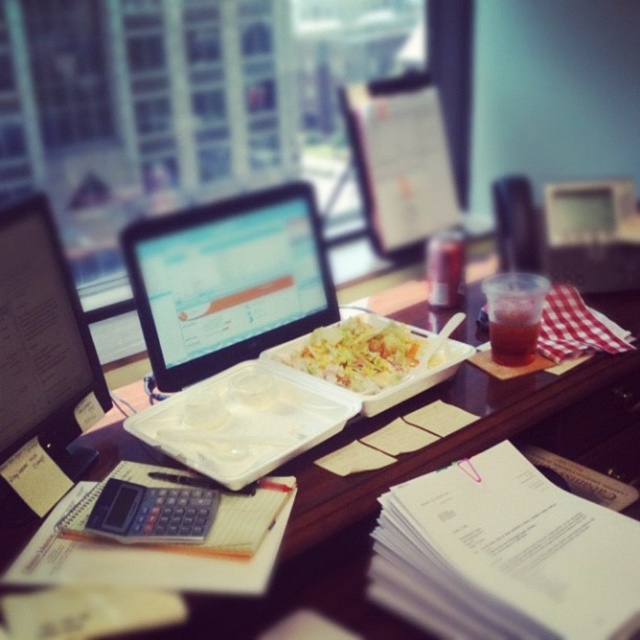
Measure the distance between point (x=323, y=333) and camera.

Point (x=323, y=333) and camera are 4.50 feet apart from each other.

Does white plastic tray at center have a greater width compared to black plastic calculator at lower left?

Yes.

Image resolution: width=640 pixels, height=640 pixels. In order to click on white plastic tray at center in this screenshot , I will do `click(358, 353)`.

Between matte black monitor at center and translucent plastic cup at center right, which one is positioned higher?

matte black monitor at center is higher up.

Is point (269, 320) positioned after point (513, 323)?

Yes.

This screenshot has width=640, height=640. Describe the element at coordinates (227, 280) in the screenshot. I see `matte black monitor at center` at that location.

Find the location of a particular element. This screenshot has height=640, width=640. matte black monitor at center is located at coordinates (227, 280).

Between wooden table at center and black plastic calculator at lower left, which one appears on the left side from the viewer's perspective?

black plastic calculator at lower left is more to the left.

This screenshot has height=640, width=640. Describe the element at coordinates (426, 472) in the screenshot. I see `wooden table at center` at that location.

Find the location of `wooden table at center`. wooden table at center is located at coordinates (426, 472).